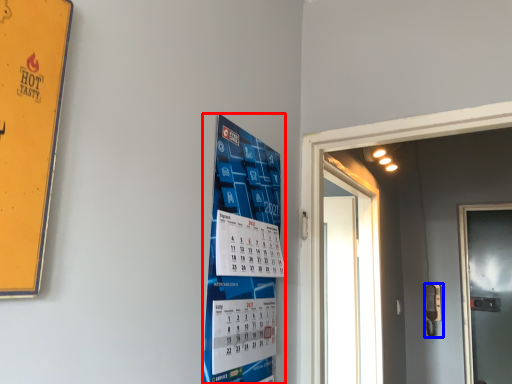
Question: Which of the following is the farthest to the observer, poster (highlighted by a red box) or door handle (highlighted by a blue box)?

Choices:
 (A) poster
 (B) door handle

Answer: (B)